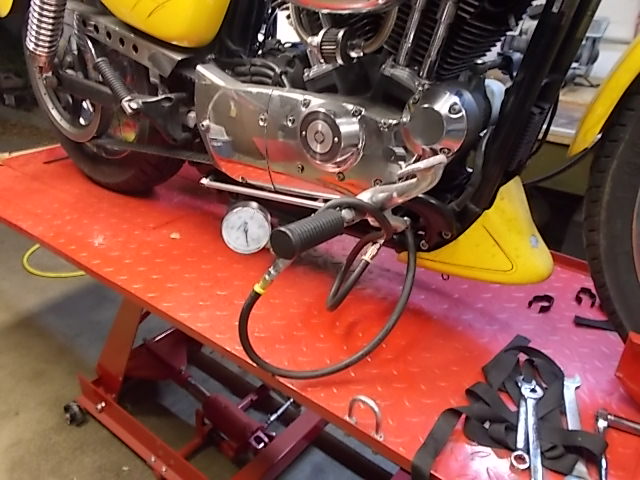
Image resolution: width=640 pixels, height=480 pixels. Find the location of `concrete floor`. concrete floor is located at coordinates (54, 387).